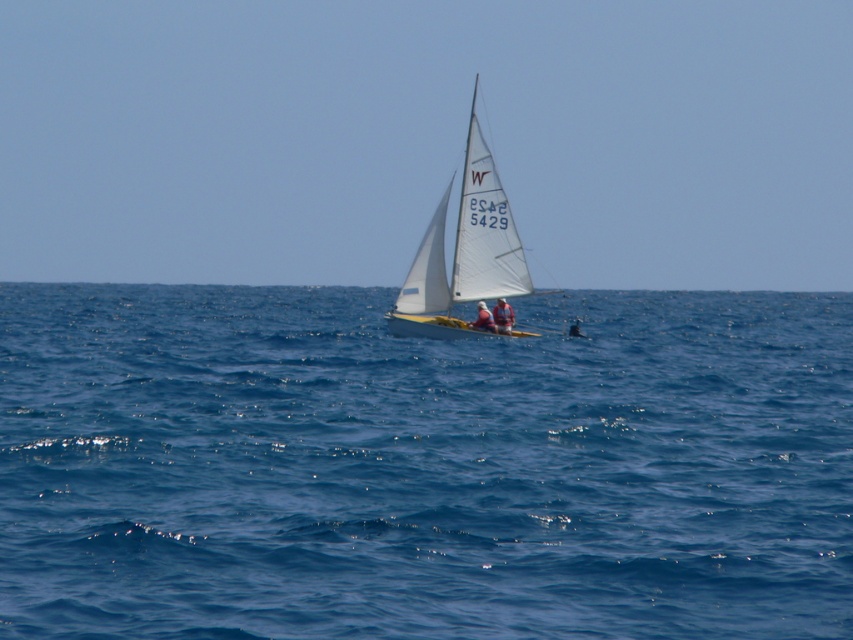
You are a sailor on a boat and you see a point at coordinates point (463, 396). The distance between you and the point is 26.37 meters. Can you reach the point by rowing 25 meters forward?

The distance between you and the point at point (463, 396) is 26.37 meters. Since you can only row 25 meters forward, you cannot reach the point as it is farther away than your rowing distance.

You are a sailor on the white sailboat at center. You notice the blue water at center is to your left or right side? Please answer based on the scene description.

The blue water at center is positioned on the right side of white sailboat at center, so from the sailor perspective on the white sailboat at center, the blue water at center would be to their right side.